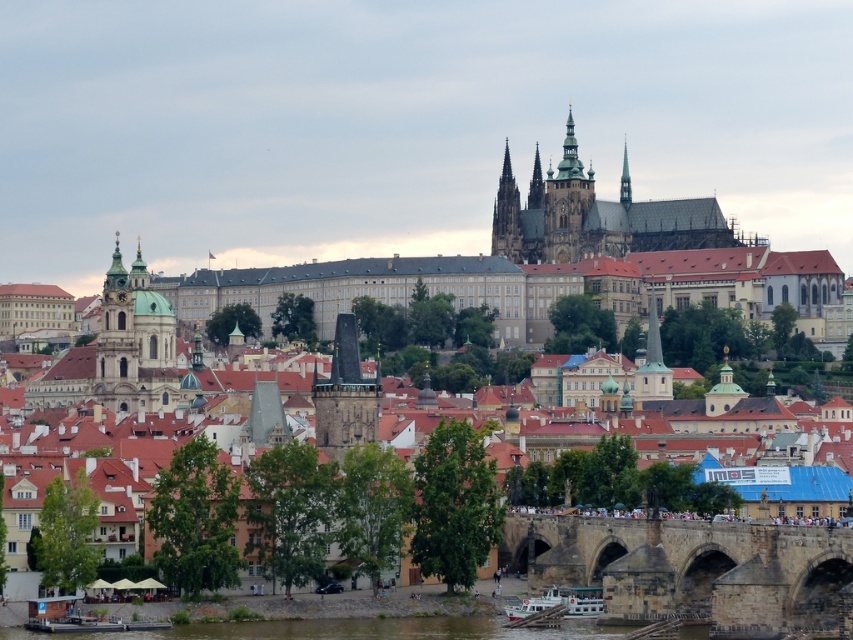
Between golden spires at center and dark gray stone spire at center, which one has less height?

Standing shorter between the two is dark gray stone spire at center.

Where is `golden spires at center`? The image size is (853, 640). golden spires at center is located at coordinates (566, 204).

Does dark gray stone tower at center have a greater height compared to dark gray stone spire at center?

In fact, dark gray stone tower at center may be shorter than dark gray stone spire at center.

How much distance is there between dark gray stone tower at center and dark gray stone spire at center?

A distance of 196.26 meters exists between dark gray stone tower at center and dark gray stone spire at center.

Locate an element on the screen. dark gray stone tower at center is located at coordinates (345, 396).

Is brown stone bridge at lower center to the right of golden spires at center from the viewer's perspective?

In fact, brown stone bridge at lower center is to the left of golden spires at center.

Is brown stone bridge at lower center bigger than golden spires at center?

Incorrect, brown stone bridge at lower center is not larger than golden spires at center.

What do you see at coordinates (694, 570) in the screenshot? I see `brown stone bridge at lower center` at bounding box center [694, 570].

Where is `brown stone bridge at lower center`? This screenshot has height=640, width=853. brown stone bridge at lower center is located at coordinates (694, 570).